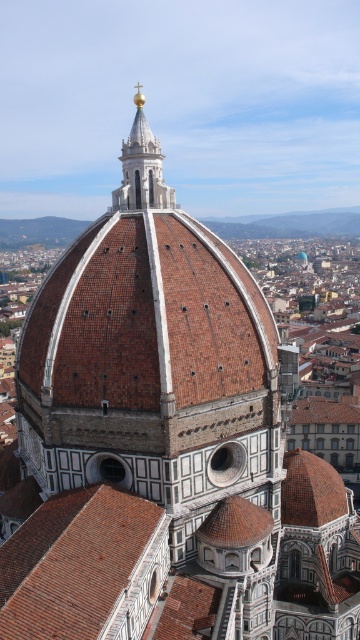
Is brown tiled roof at center closer to the viewer compared to polished gold spire at upper center?

Yes, it is.

Does point (5, 580) come farther from viewer compared to point (123, 193)?

No.

You are a GUI agent. You are given a task and a screenshot of the screen. Output one action in this format:
    pyautogui.click(x=<x>, y=<y>)
    Task: Click on the brown tiled roof at center
    The width and height of the screenshot is (360, 640).
    Given the screenshot: What is the action you would take?
    (83, 566)